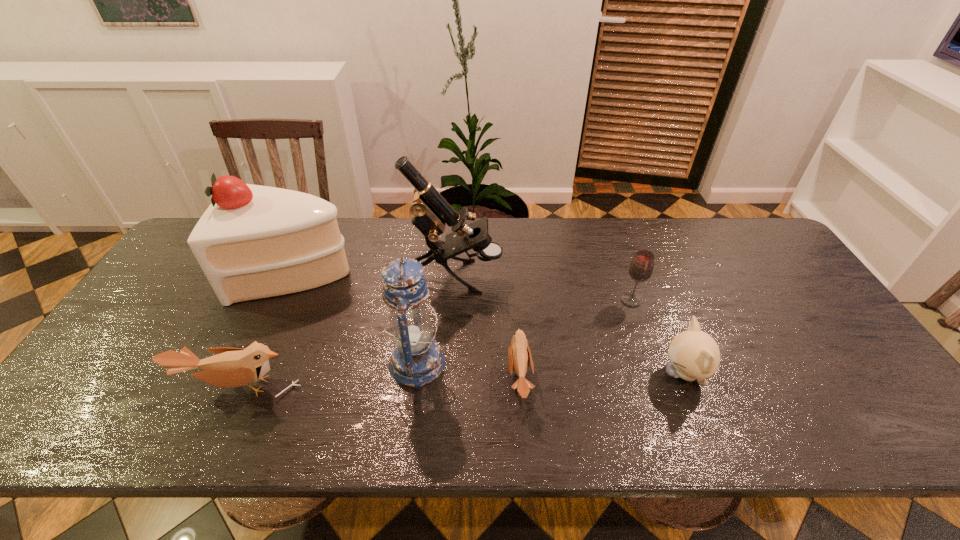
Please point a free position for a bird on the right. Please provide its 2D coordinates. Your answer should be formatted as a tuple, i.e. [(x, y)], where the tuple contains the x and y coordinates of a point satisfying the conditions above.

[(792, 370)]